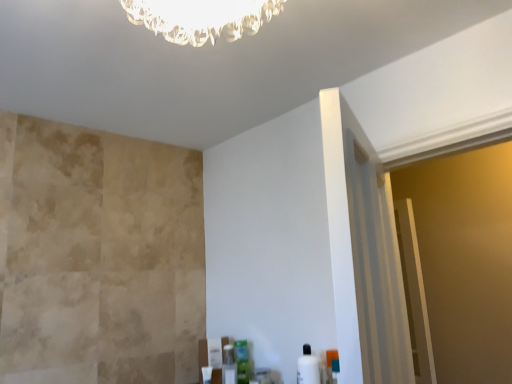
What are the coordinates of `white glossy bottle at lower right, the third toiletry in the left-to-right sequence` in the screenshot? It's located at (308, 367).

Looking at this image, what is the approximate width of green plastic container at lower center, which appears as the 2th toiletry when viewed from the right?

2.72 inches.

This screenshot has width=512, height=384. I want to click on clear plastic bottle at lower center, the third toiletry viewed from the right, so click(229, 365).

Considering the relative sizes of clear plastic bottle at lower center, the first toiletry viewed from the back, and green plastic container at lower center, the 2th toiletry positioned from the front, in the image provided, is clear plastic bottle at lower center, the first toiletry viewed from the back, thinner than green plastic container at lower center, the 2th toiletry positioned from the front,?

Answer: Correct, the width of clear plastic bottle at lower center, the first toiletry viewed from the back, is less than that of green plastic container at lower center, the 2th toiletry positioned from the front.

Considering the sizes of objects clear plastic bottle at lower center, the first toiletry in the left-to-right sequence, and green plastic container at lower center, the 2th toiletry positioned from the front, in the image provided, who is smaller, clear plastic bottle at lower center, the first toiletry in the left-to-right sequence, or green plastic container at lower center, the 2th toiletry positioned from the front,?

With smaller size is clear plastic bottle at lower center, the first toiletry in the left-to-right sequence.

Is point (236, 378) more distant than point (248, 356)?

No.

From a real-world perspective, is clear plastic bottle at lower center, the first toiletry viewed from the back, physically above green plastic container at lower center, placed as the 2th toiletry when sorted from back to front?

No.

Does white glossy bottle at lower right, the 1th toiletry when ordered from right to left, touch green plastic container at lower center, which appears as the 2th toiletry when viewed from the right?

There is a gap between white glossy bottle at lower right, the 1th toiletry when ordered from right to left, and green plastic container at lower center, which appears as the 2th toiletry when viewed from the right.

Between white glossy bottle at lower right, which ranks as the 3th toiletry in back-to-front order, and green plastic container at lower center, placed as the 2th toiletry when sorted from back to front, which one has less height?

green plastic container at lower center, placed as the 2th toiletry when sorted from back to front.

Considering the relative positions of white glossy bottle at lower right, the third toiletry in the left-to-right sequence, and green plastic container at lower center, which is the second toiletry from left to right, in the image provided, is white glossy bottle at lower right, the third toiletry in the left-to-right sequence, to the right of green plastic container at lower center, which is the second toiletry from left to right, from the viewer's perspective?

Indeed, white glossy bottle at lower right, the third toiletry in the left-to-right sequence, is positioned on the right side of green plastic container at lower center, which is the second toiletry from left to right.

Considering the sizes of white glossy bottle at lower right, the 1th toiletry positioned from the front, and green plastic container at lower center, placed as the 2th toiletry when sorted from back to front, in the image, is white glossy bottle at lower right, the 1th toiletry positioned from the front, wider or thinner than green plastic container at lower center, placed as the 2th toiletry when sorted from back to front,?

Clearly, white glossy bottle at lower right, the 1th toiletry positioned from the front, has more width compared to green plastic container at lower center, placed as the 2th toiletry when sorted from back to front.

Considering the relative sizes of green plastic container at lower center, the 2th toiletry positioned from the front, and white glossy bottle at lower right, the third toiletry in the left-to-right sequence, in the image provided, is green plastic container at lower center, the 2th toiletry positioned from the front, wider than white glossy bottle at lower right, the third toiletry in the left-to-right sequence,?

No.

Is green plastic container at lower center, placed as the 2th toiletry when sorted from back to front, with white glossy bottle at lower right, the 1th toiletry positioned from the front?

No, green plastic container at lower center, placed as the 2th toiletry when sorted from back to front, is not with white glossy bottle at lower right, the 1th toiletry positioned from the front.

The width and height of the screenshot is (512, 384). There is a white glossy bottle at lower right, the 1th toiletry positioned from the front. Find the location of `the 1st toiletry below it (from a real-world perspective)`. the 1st toiletry below it (from a real-world perspective) is located at coordinates (242, 361).

Between green plastic container at lower center, placed as the 2th toiletry when sorted from back to front, and white glossy bottle at lower right, the third toiletry in the left-to-right sequence, which one is positioned in front?

Positioned in front is white glossy bottle at lower right, the third toiletry in the left-to-right sequence.

Is green plastic container at lower center, the 2th toiletry positioned from the front, surrounding clear plastic bottle at lower center, the third toiletry viewed from the right?

That's incorrect, clear plastic bottle at lower center, the third toiletry viewed from the right, is not inside green plastic container at lower center, the 2th toiletry positioned from the front.

From the image's perspective, between green plastic container at lower center, placed as the 2th toiletry when sorted from back to front, and clear plastic bottle at lower center, the first toiletry viewed from the back, which one is located above?

green plastic container at lower center, placed as the 2th toiletry when sorted from back to front.

Between green plastic container at lower center, the 2th toiletry positioned from the front, and clear plastic bottle at lower center, the first toiletry in the left-to-right sequence, which one appears on the left side from the viewer's perspective?

From the viewer's perspective, clear plastic bottle at lower center, the first toiletry in the left-to-right sequence, appears more on the left side.

Is white glossy bottle at lower right, the 1th toiletry when ordered from right to left, beside clear plastic bottle at lower center, the third toiletry viewed from the right?

There is a gap between white glossy bottle at lower right, the 1th toiletry when ordered from right to left, and clear plastic bottle at lower center, the third toiletry viewed from the right.

In terms of height, does white glossy bottle at lower right, the third toiletry in the left-to-right sequence, look taller or shorter compared to clear plastic bottle at lower center, the first toiletry in the left-to-right sequence?

Considering their sizes, white glossy bottle at lower right, the third toiletry in the left-to-right sequence, has more height than clear plastic bottle at lower center, the first toiletry in the left-to-right sequence.

Based on the photo, from a real-world perspective, is white glossy bottle at lower right, the 1th toiletry when ordered from right to left, beneath clear plastic bottle at lower center, the third toiletry viewed from the right?

No, from a real-world perspective, white glossy bottle at lower right, the 1th toiletry when ordered from right to left, is not below clear plastic bottle at lower center, the third toiletry viewed from the right.

Would you say white glossy bottle at lower right, which ranks as the 3th toiletry in back-to-front order, is to the left or to the right of clear plastic bottle at lower center, the first toiletry in the left-to-right sequence, in the picture?

white glossy bottle at lower right, which ranks as the 3th toiletry in back-to-front order, is to the right of clear plastic bottle at lower center, the first toiletry in the left-to-right sequence.

From the image's perspective, does clear plastic bottle at lower center, the third toiletry viewed from the right, appear higher than white glossy bottle at lower right, which ranks as the 3th toiletry in back-to-front order?

No.

Considering the sizes of objects clear plastic bottle at lower center, the first toiletry in the left-to-right sequence, and white glossy bottle at lower right, the 1th toiletry when ordered from right to left, in the image provided, who is wider, clear plastic bottle at lower center, the first toiletry in the left-to-right sequence, or white glossy bottle at lower right, the 1th toiletry when ordered from right to left,?

Wider between the two is white glossy bottle at lower right, the 1th toiletry when ordered from right to left.

How different are the orientations of clear plastic bottle at lower center, the third toiletry viewed from the right, and white glossy bottle at lower right, which ranks as the 3th toiletry in back-to-front order, in degrees?

They differ by 0.324 degrees in their facing directions.

Is white glossy bottle at lower right, the 1th toiletry when ordered from right to left, at the back of clear plastic bottle at lower center, the 3th toiletry when ordered from front to back?

No, white glossy bottle at lower right, the 1th toiletry when ordered from right to left, is not at the back of clear plastic bottle at lower center, the 3th toiletry when ordered from front to back.

The height and width of the screenshot is (384, 512). What are the coordinates of `toiletry on the left of green plastic container at lower center, the 2th toiletry positioned from the front` in the screenshot? It's located at (229, 365).

Image resolution: width=512 pixels, height=384 pixels. What are the coordinates of `toiletry on the right of green plastic container at lower center, the 2th toiletry positioned from the front` in the screenshot? It's located at (308, 367).

Which object lies further to the anchor point green plastic container at lower center, which is the second toiletry from left to right, white glossy bottle at lower right, the 1th toiletry when ordered from right to left, or clear plastic bottle at lower center, the 3th toiletry when ordered from front to back?

white glossy bottle at lower right, the 1th toiletry when ordered from right to left, is positioned further to the anchor green plastic container at lower center, which is the second toiletry from left to right.

From the image, which object appears to be farther from clear plastic bottle at lower center, the first toiletry in the left-to-right sequence, green plastic container at lower center, which is the second toiletry from left to right, or white glossy bottle at lower right, which ranks as the 3th toiletry in back-to-front order?

white glossy bottle at lower right, which ranks as the 3th toiletry in back-to-front order, is positioned further to the anchor clear plastic bottle at lower center, the first toiletry in the left-to-right sequence.

Based on their spatial positions, is clear plastic bottle at lower center, the third toiletry viewed from the right, or green plastic container at lower center, which is the second toiletry from left to right, further from white glossy bottle at lower right, the 1th toiletry when ordered from right to left?

clear plastic bottle at lower center, the third toiletry viewed from the right, is further to white glossy bottle at lower right, the 1th toiletry when ordered from right to left.

Based on their spatial positions, is white glossy bottle at lower right, the 1th toiletry when ordered from right to left, or green plastic container at lower center, the 2th toiletry positioned from the front, further from clear plastic bottle at lower center, the first toiletry viewed from the back?

Among the two, white glossy bottle at lower right, the 1th toiletry when ordered from right to left, is located further to clear plastic bottle at lower center, the first toiletry viewed from the back.

Estimate the real-world distances between objects in this image. Which object is closer to white glossy bottle at lower right, the 1th toiletry positioned from the front, green plastic container at lower center, which appears as the 2th toiletry when viewed from the right, or clear plastic bottle at lower center, the first toiletry viewed from the back?

Based on the image, green plastic container at lower center, which appears as the 2th toiletry when viewed from the right, appears to be nearer to white glossy bottle at lower right, the 1th toiletry positioned from the front.

Considering their positions, is clear plastic bottle at lower center, the 3th toiletry when ordered from front to back, positioned further to green plastic container at lower center, the 2th toiletry positioned from the front, than white glossy bottle at lower right, the 1th toiletry when ordered from right to left?

Among the two, white glossy bottle at lower right, the 1th toiletry when ordered from right to left, is located further to green plastic container at lower center, the 2th toiletry positioned from the front.

Where is `toiletry between white glossy bottle at lower right, the third toiletry in the left-to-right sequence, and clear plastic bottle at lower center, the 3th toiletry when ordered from front to back, along the z-axis`? The width and height of the screenshot is (512, 384). toiletry between white glossy bottle at lower right, the third toiletry in the left-to-right sequence, and clear plastic bottle at lower center, the 3th toiletry when ordered from front to back, along the z-axis is located at coordinates (242, 361).